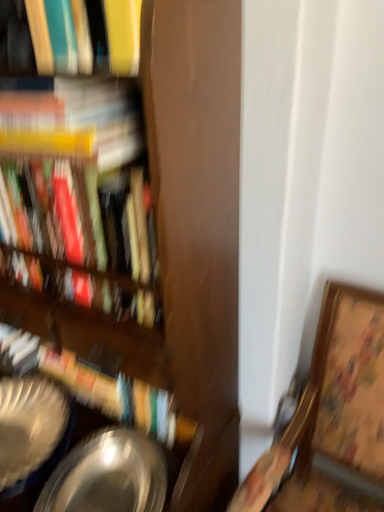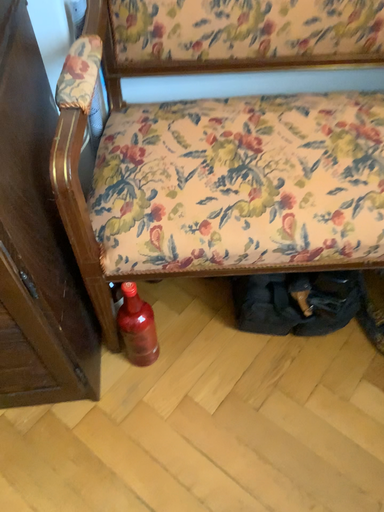
Question: Which way did the camera rotate in the video?

Choices:
 (A) rotated right
 (B) rotated left

Answer: (A)